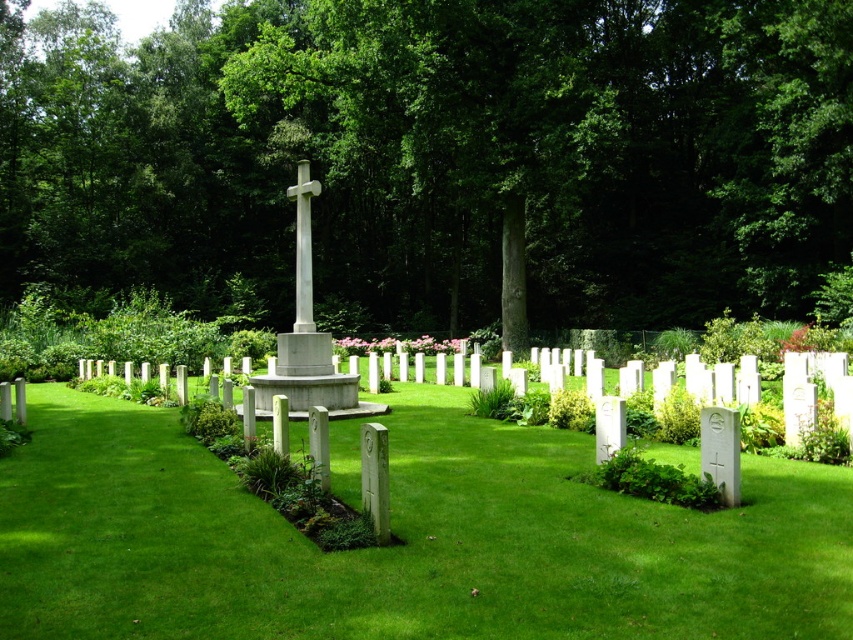
You are a visitor at the cemetery and want to locate both the gray stone cross at center and the white marble cross at center. According to the scene, which cross is positioned to the right of the other?

The gray stone cross at center is positioned to the right of the white marble cross at center.

You are a groundskeeper tasked with mowing the lawn. You notice the green grass at center and the white marble cross at center in the cemetery. Which object is shorter in height?

The green grass at center is not as tall as the white marble cross at center, so the green grass at center is shorter in height.